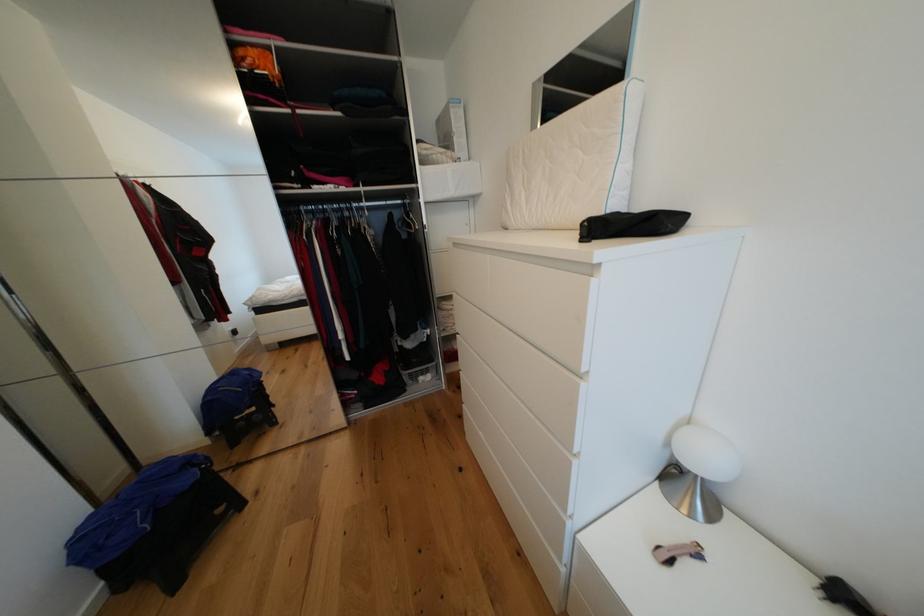
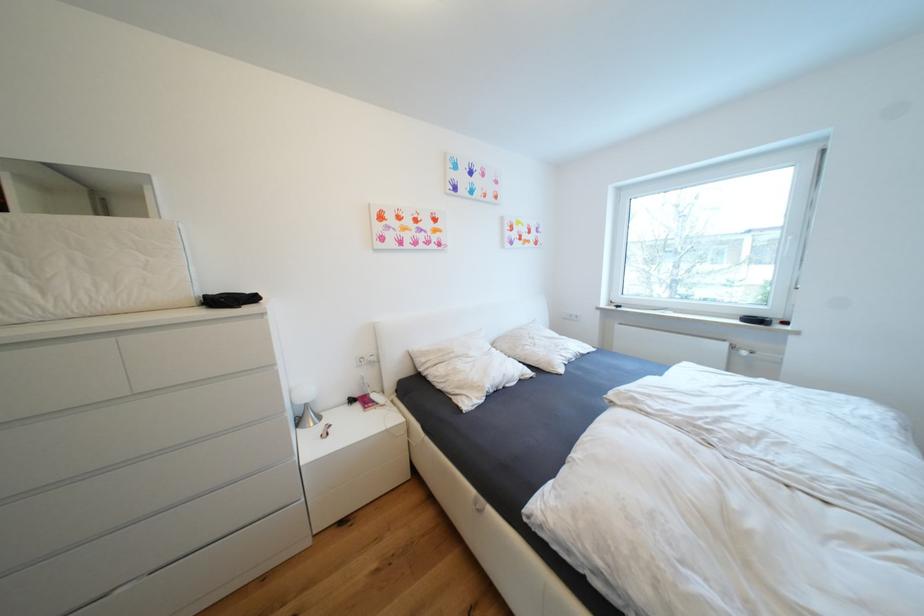
Find the pixel in the second image that matches point (646, 209) in the first image.

(222, 294)